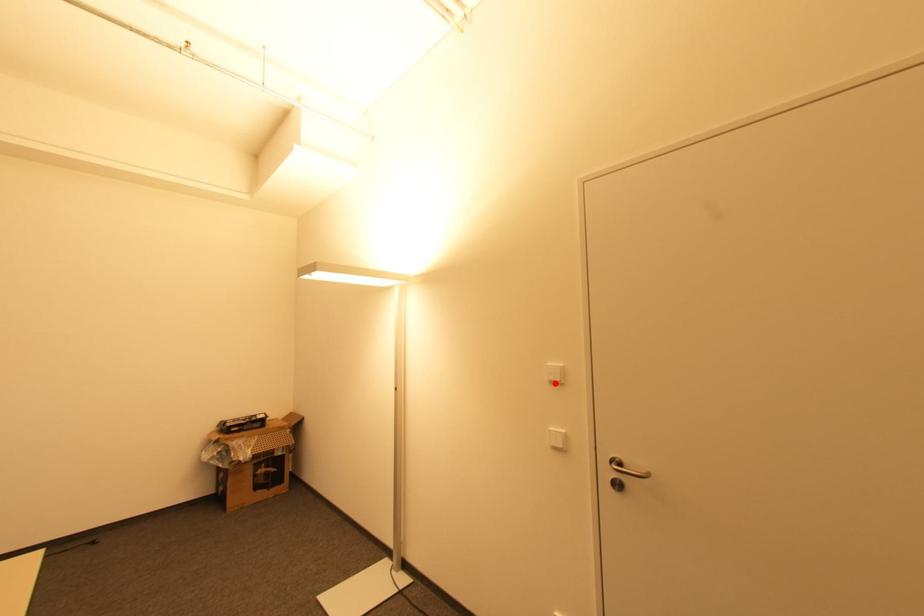
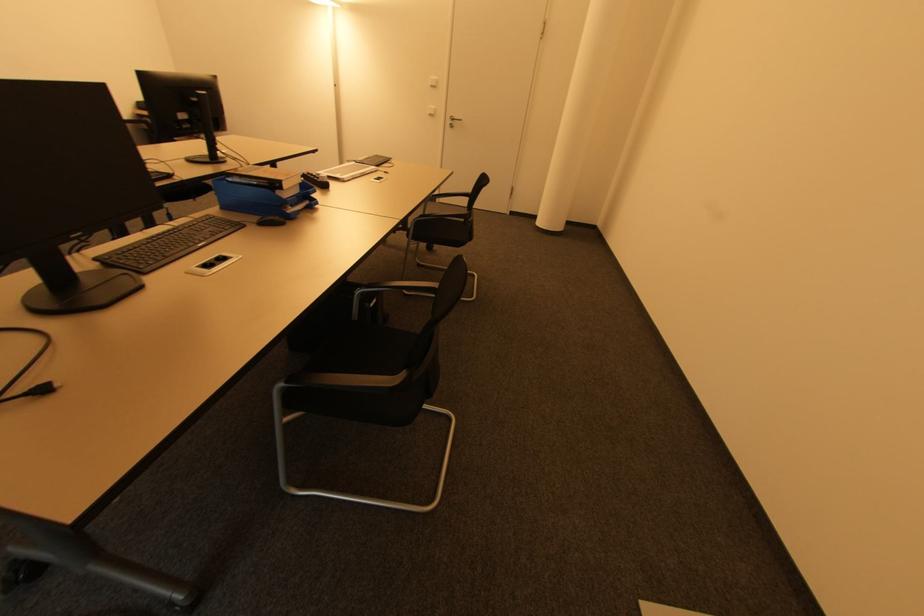
Locate, in the second image, the point that corresponds to the highlighted location in the first image.

(434, 87)